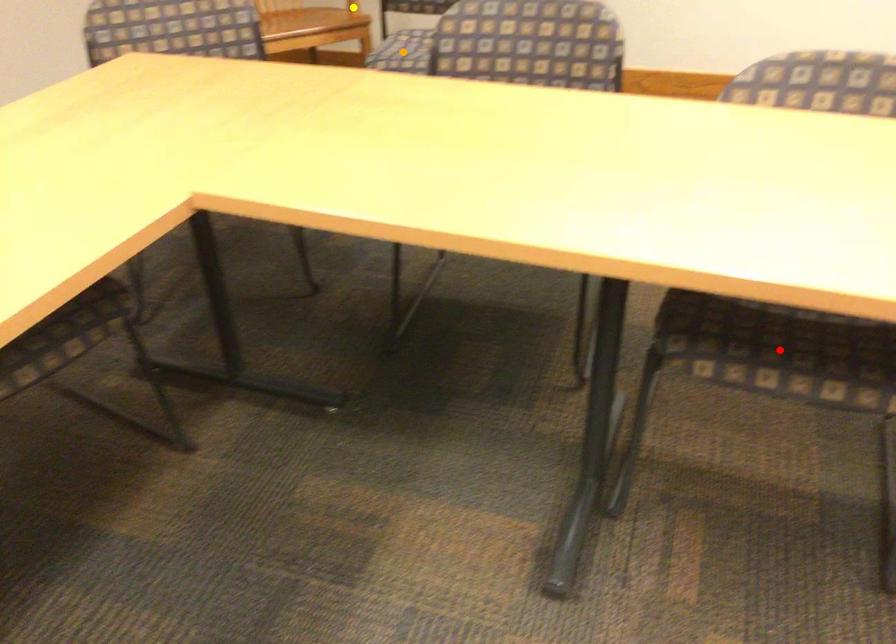
Order these from nearest to farthest:
1. orange point
2. yellow point
3. red point

yellow point → orange point → red point